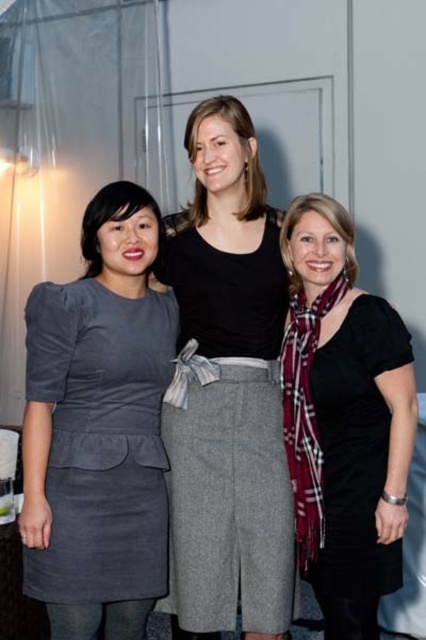
Based on the photo, between plaid scarf at center and gray suede dress at left, which one is positioned higher?

Positioned higher is plaid scarf at center.

Is plaid scarf at center bigger than gray suede dress at left?

Correct, plaid scarf at center is larger in size than gray suede dress at left.

The image size is (426, 640). What do you see at coordinates (345, 417) in the screenshot?
I see `plaid scarf at center` at bounding box center [345, 417].

The width and height of the screenshot is (426, 640). In order to click on plaid scarf at center in this screenshot , I will do `click(345, 417)`.

Is the position of black cotton shirt at center more distant than that of plaid scarf at center?

Yes, black cotton shirt at center is behind plaid scarf at center.

Does black cotton shirt at center have a smaller size compared to plaid scarf at center?

Actually, black cotton shirt at center might be larger than plaid scarf at center.

You are a GUI agent. You are given a task and a screenshot of the screen. Output one action in this format:
    pyautogui.click(x=<x>, y=<y>)
    Task: Click on the black cotton shirt at center
    
    Given the screenshot: What is the action you would take?
    pyautogui.click(x=229, y=392)

I want to click on black cotton shirt at center, so click(x=229, y=392).

Who is more forward, [242,138] or [157,371]?

Point [157,371]

Does point (261, 420) come closer to viewer compared to point (112, 592)?

That is False.

Is point (233, 346) positioned after point (123, 323)?

Yes, it is behind point (123, 323).

Locate an element on the screen. Image resolution: width=426 pixels, height=640 pixels. black cotton shirt at center is located at coordinates (229, 392).